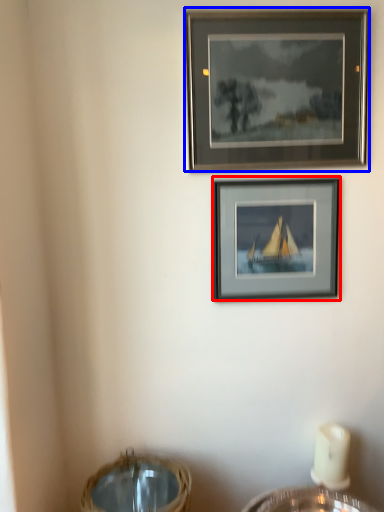
Question: Which of the following is the closest to the observer, picture frame (highlighted by a red box) or picture frame (highlighted by a blue box)?

Choices:
 (A) picture frame
 (B) picture frame

Answer: (B)